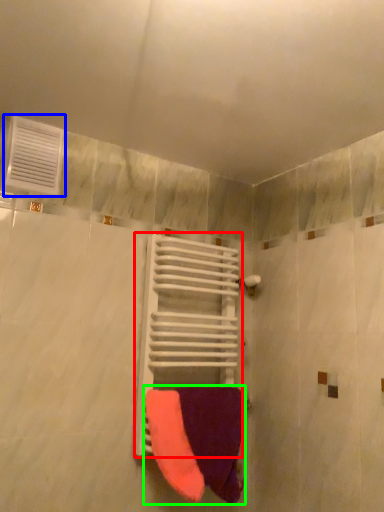
Question: Considering the real-world distances, which object is farthest from balustrade (highlighted by a red box)? air conditioning (highlighted by a blue box) or towel (highlighted by a green box)?

Choices:
 (A) air conditioning
 (B) towel

Answer: (A)